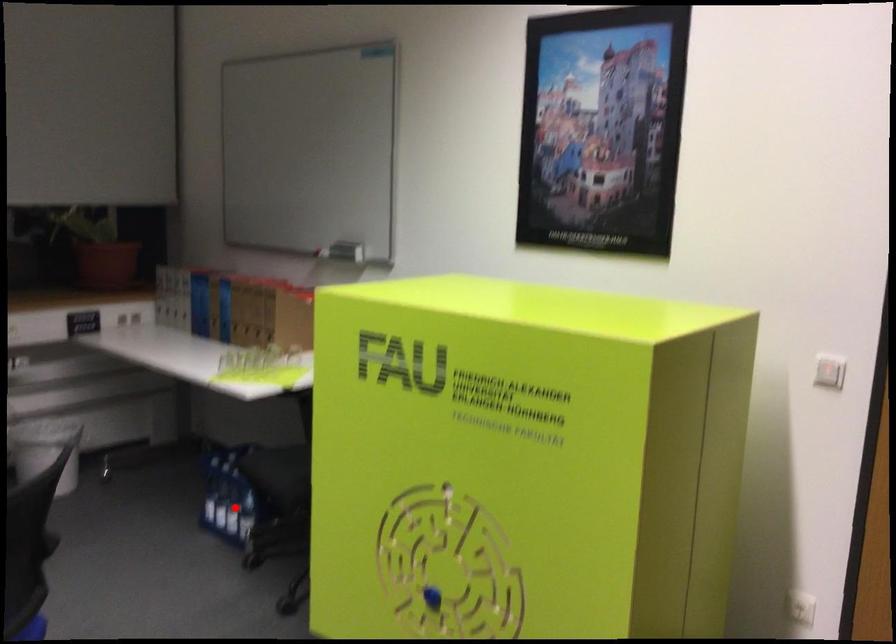
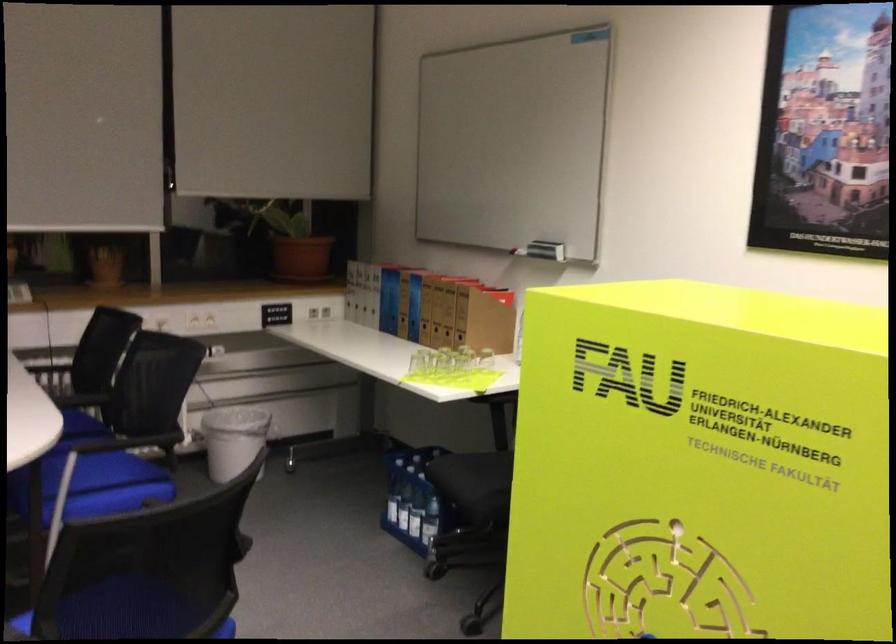
Find the pixel in the second image that matches the highlighted location in the first image.

(416, 514)